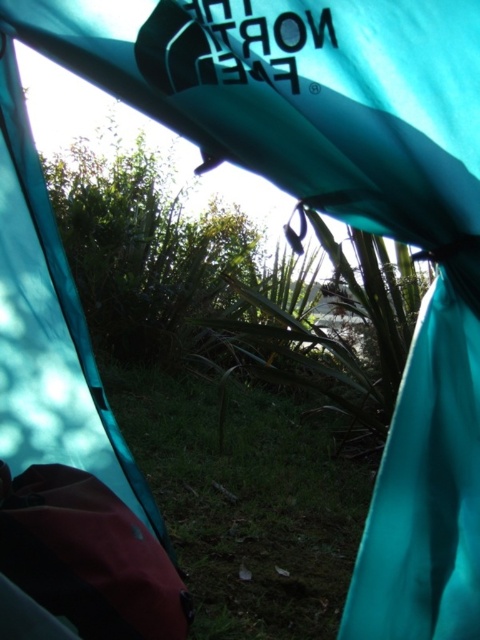
Question: Which point is closer to the camera?

Choices:
 (A) (179, 524)
 (B) (182, 618)
 (C) (32, 22)

Answer: (C)

Question: Can you confirm if teal fabric tent at upper left is positioned to the left of maroon synthetic sleeping bag at lower left?

Choices:
 (A) no
 (B) yes

Answer: (A)

Question: Which of these objects is positioned closest to the green grass at center?

Choices:
 (A) teal fabric tent at upper left
 (B) maroon synthetic sleeping bag at lower left

Answer: (B)

Question: Is teal fabric tent at upper left positioned behind green grass at center?

Choices:
 (A) yes
 (B) no

Answer: (B)

Question: Does teal fabric tent at upper left come in front of green grass at center?

Choices:
 (A) yes
 (B) no

Answer: (A)

Question: Which point is closer to the camera taking this photo?

Choices:
 (A) (276, 614)
 (B) (143, 596)
 (C) (52, 426)

Answer: (B)